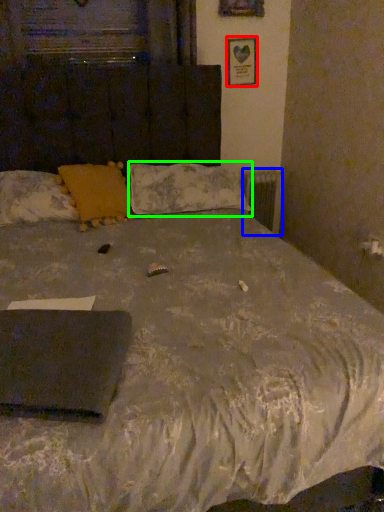
Question: Considering the real-world distances, which object is closest to picture frame (highlighted by a red box)? radiator (highlighted by a blue box) or pillow (highlighted by a green box).

Choices:
 (A) radiator
 (B) pillow

Answer: (A)